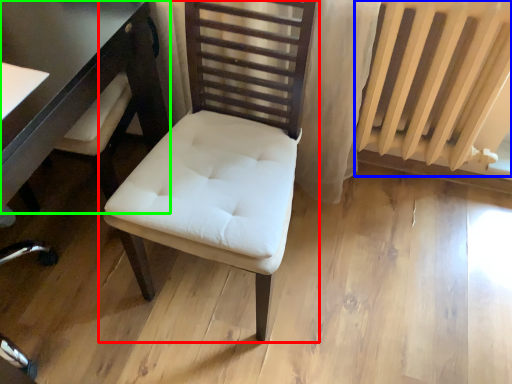
Question: Which is nearer to the chair (highlighted by a red box)? radiator (highlighted by a blue box) or table (highlighted by a green box).

Choices:
 (A) radiator
 (B) table

Answer: (B)